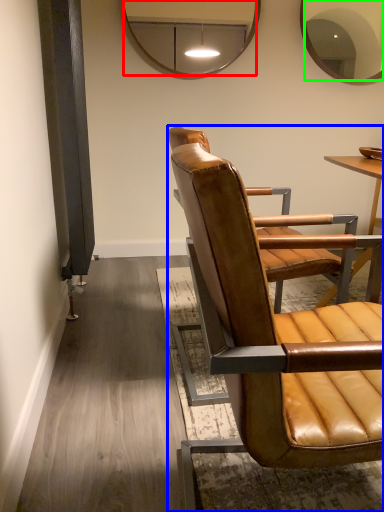
Question: Which is farther away from mirror (highlighted by a red box)? chair (highlighted by a blue box) or mirror (highlighted by a green box)?

Choices:
 (A) chair
 (B) mirror

Answer: (A)